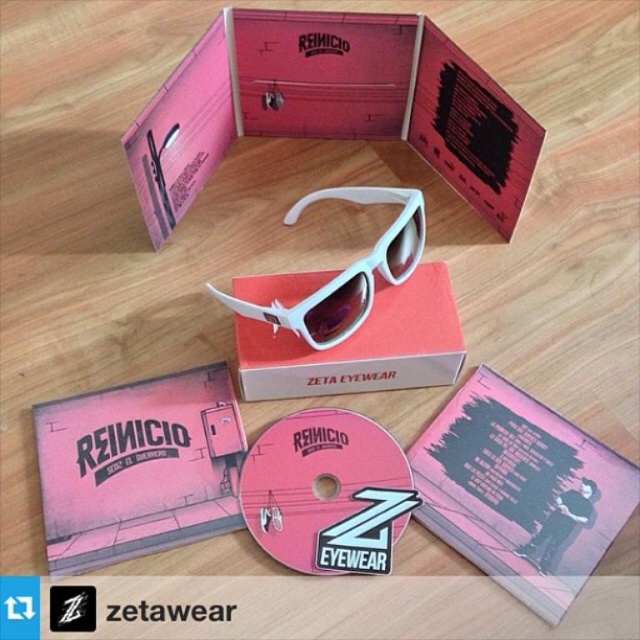
Who is lower down, matte pink album at center or white matte box at center?

matte pink album at center is below.

Can you confirm if matte pink album at center is positioned above white matte box at center?

No, matte pink album at center is not above white matte box at center.

This screenshot has height=640, width=640. I want to click on matte pink album at center, so click(138, 467).

Is matte pink cardboard box at center to the right of pink matte cd at center from the viewer's perspective?

Yes, matte pink cardboard box at center is to the right of pink matte cd at center.

Which is more to the left, matte pink cardboard box at center or pink matte cd at center?

pink matte cd at center is more to the left.

Where is `matte pink cardboard box at center`? matte pink cardboard box at center is located at coordinates (x=330, y=106).

Who is taller, matte pink cardboard box at center or white matte sunglasses at center?

matte pink cardboard box at center is taller.

The width and height of the screenshot is (640, 640). What do you see at coordinates (330, 106) in the screenshot?
I see `matte pink cardboard box at center` at bounding box center [330, 106].

Is point (296, 76) more distant than point (396, 282)?

Yes.

Where is `matte pink cardboard box at center`? The height and width of the screenshot is (640, 640). matte pink cardboard box at center is located at coordinates (330, 106).